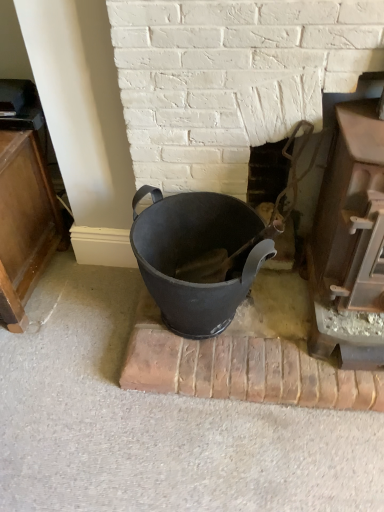
Question: In terms of width, does matte black bucket at center look wider or thinner when compared to smooth brown wood at right, which ranks as the 3th fireplace in left-to-right order?

Choices:
 (A) wide
 (B) thin

Answer: (B)

Question: In the image, is matte black bucket at center positioned in front of or behind smooth brown wood at right, the 1th fireplace positioned from the right?

Choices:
 (A) behind
 (B) front

Answer: (A)

Question: Which is nearer to the smooth brown wood at right, the 1th fireplace positioned from the right?

Choices:
 (A) smooth metal fireplace at center, marked as the second fireplace in a right-to-left arrangement
 (B) smooth black bucket at center, the 1th fireplace positioned from the left
 (C) matte black bucket at center

Answer: (A)

Question: Considering the real-world distances, which object is closest to the smooth brown wood at right, the 1th fireplace positioned from the right?

Choices:
 (A) smooth metal fireplace at center, marked as the second fireplace in a right-to-left arrangement
 (B) matte black bucket at center
 (C) smooth black bucket at center, the 1th fireplace positioned from the left

Answer: (A)